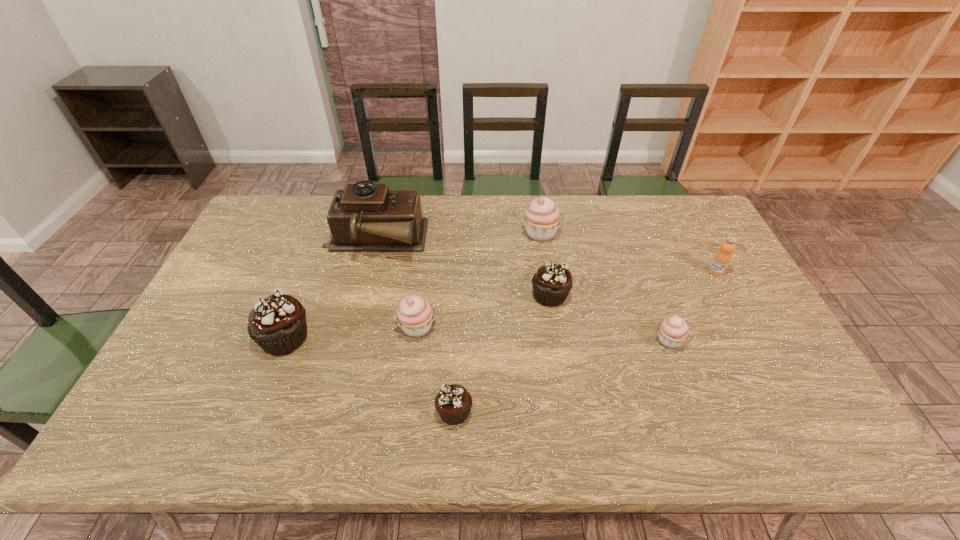
Identify the location of the second smallest pink cupcake. (415, 314).

At what (x,y) coordinates should I click in order to perform the action: click on the smallest pink cupcake. Please return your answer as a coordinate pair (x, y). The width and height of the screenshot is (960, 540). Looking at the image, I should click on coord(673,331).

Image resolution: width=960 pixels, height=540 pixels. I want to click on the rightmost pink cupcake, so click(673, 331).

The width and height of the screenshot is (960, 540). I want to click on the nearest object, so click(x=453, y=403).

The width and height of the screenshot is (960, 540). In order to click on the second brown cupcake from right to left in this screenshot , I will do `click(453, 403)`.

The width and height of the screenshot is (960, 540). In order to click on vacant space located on the horn of the tallest object in this screenshot , I will do `click(473, 241)`.

Identify the location of vacant space located on the back of the biggest pink cupcake. (536, 201).

Locate an element on the screen. Image resolution: width=960 pixels, height=540 pixels. free spot located 0.280m on the back of the leftmost cupcake is located at coordinates (319, 252).

You are a GUI agent. You are given a task and a screenshot of the screen. Output one action in this format:
    pyautogui.click(x=<x>, y=<y>)
    Task: Click on the vacant space located on the front label of the orange juice
    This screenshot has width=960, height=540.
    Given the screenshot: What is the action you would take?
    729,296

Locate an element on the screen. This screenshot has height=540, width=960. vacant space located on the right of the fourth farthest object is located at coordinates [x=596, y=295].